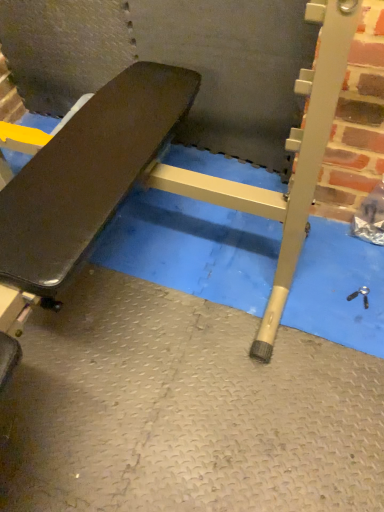
Image resolution: width=384 pixels, height=512 pixels. What do you see at coordinates (360, 294) in the screenshot?
I see `metallic silver screw at lower right` at bounding box center [360, 294].

At what (x,y) coordinates should I click in order to perform the action: click on metallic silver screw at lower right. Please return your answer as a coordinate pair (x, y). Looking at the image, I should click on 360,294.

The image size is (384, 512). I want to click on metallic silver screw at lower right, so click(360, 294).